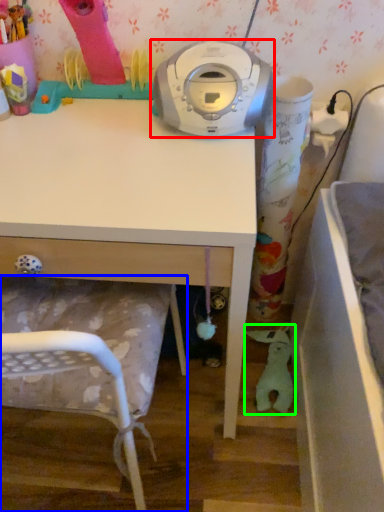
Question: Which is farther away from home appliance (highlighted by a red box)? chair (highlighted by a blue box) or toy (highlighted by a green box)?

Choices:
 (A) chair
 (B) toy

Answer: (B)